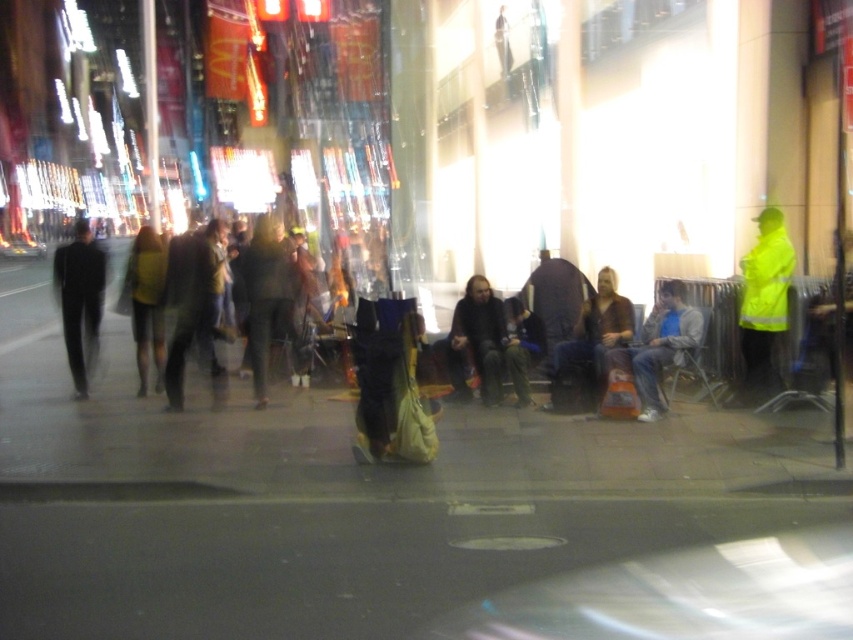
You are a photographer trying to capture the dark brown leather jacket at center in the image. What are the coordinates where you should focus your camera?

The dark brown leather jacket at center is located at coordinates point (497, 339).

You are standing at the point with coordinates point (161, 328) and want to walk to the point with coordinates point (469, 337). Which direction should you move to reach your destination?

You should move forward because point (469, 337) is in front of point (161, 328).